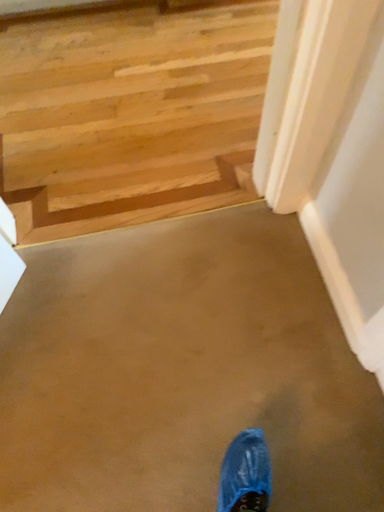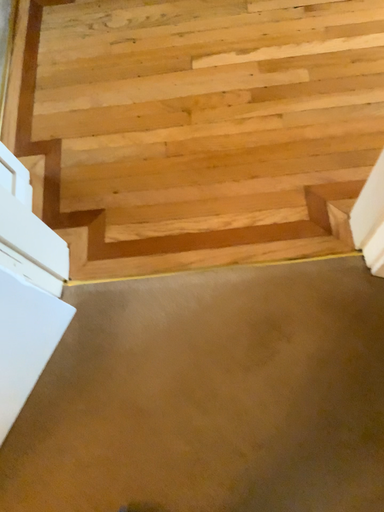
Question: How did the camera likely rotate when shooting the video?

Choices:
 (A) rotated left
 (B) rotated right

Answer: (A)